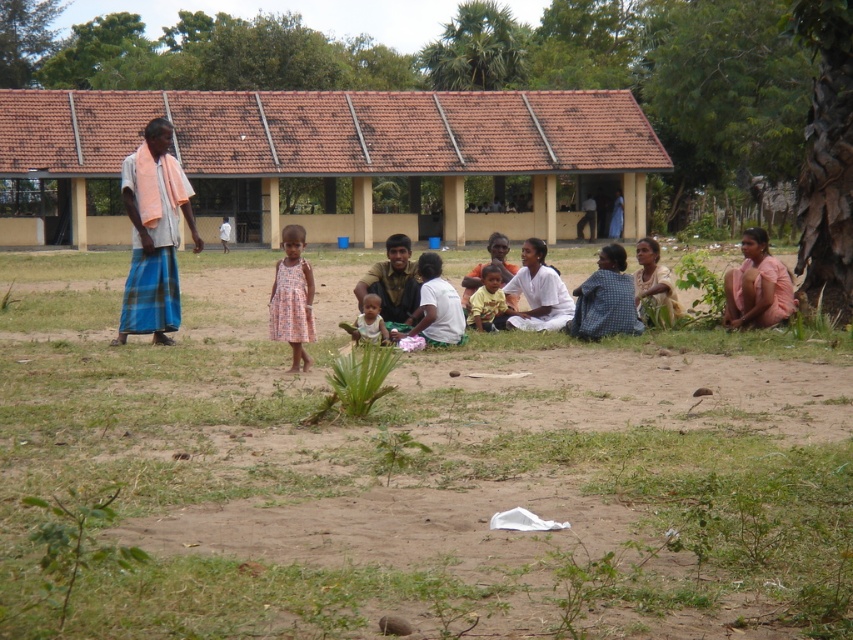
Question: Which object appears closest to the camera in this image?

Choices:
 (A) dark brown fabric shirt at center
 (B) brown sandy ground at center
 (C) pink fabric at center
 (D) brown tiled roof at upper center

Answer: (B)

Question: Does pink fabric at lower right appear on the left side of checkered fabric shirt at center?

Choices:
 (A) no
 (B) yes

Answer: (A)

Question: Is white cloth at center closer to camera compared to light brown fabric dress at right?

Choices:
 (A) no
 (B) yes

Answer: (A)

Question: Which of these objects is positioned closest to the dusty pink dress at center?

Choices:
 (A) pink fabric at lower right
 (B) brown sandy ground at center
 (C) light pink fabric at center

Answer: (C)

Question: Is the position of pink fabric at lower right less distant than that of white cotton shirt at center?

Choices:
 (A) yes
 (B) no

Answer: (B)

Question: Which point appears farthest from the camera in this image?

Choices:
 (A) (409, 316)
 (B) (392, 552)
 (C) (497, 253)

Answer: (C)